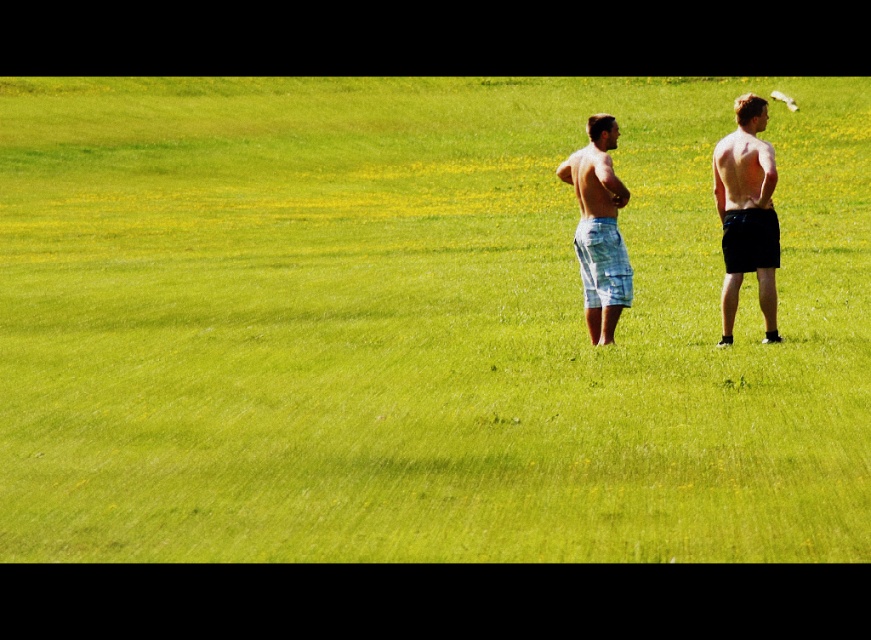
You are a photographer trying to capture a group photo of the black matte shorts at right and the light blue plaid shorts at center. The camera you are using has a minimum focusing distance of 1 meter. Will you need to adjust your position to ensure both subjects are in focus?

The distance between the black matte shorts at right and the light blue plaid shorts at center is 91.20 centimeters, which is less than the camera minimum focusing distance of 1 meter. Therefore, you will need to move closer to ensure both subjects are within the camera focusing range.

You are a photographer trying to capture both individuals in a single frame. Given that the black matte shorts at right is larger in the photo than the light blue plaid shorts at center, which individual should you position closer to the camera to ensure both appear equally sized in the final image?

Since the black matte shorts at right has a larger size compared to the light blue plaid shorts at center, you should position the individual wearing the black matte shorts at right farther away from the camera and the one with light blue plaid shorts at center closer. This way, their sizes in the photo will balance out.